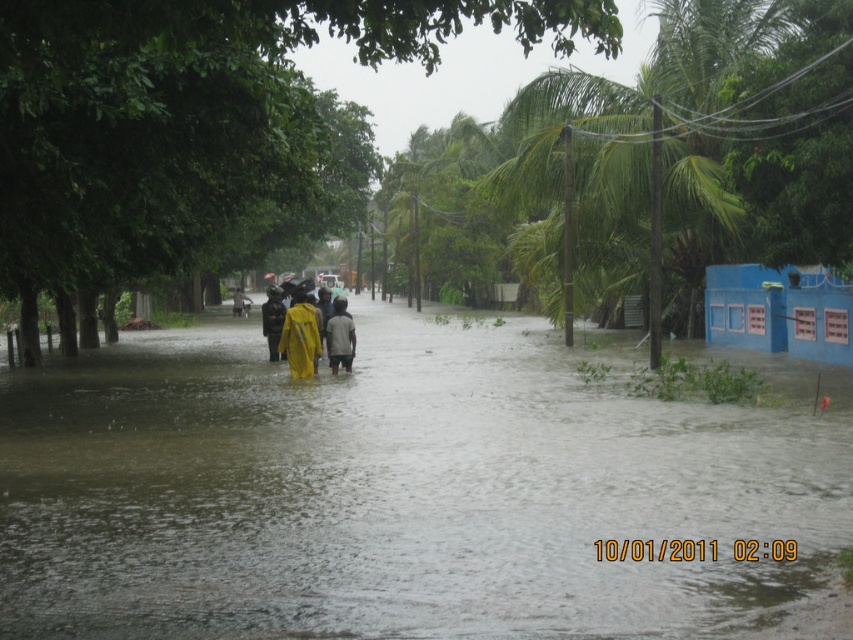
At what (x,y) coordinates should I click in order to perform the action: click on brown murky water at center. Please return your answer as a coordinate pair (x, y). Looking at the image, I should click on (392, 492).

Between point (572, 452) and point (267, 346), which one is positioned in front?

Point (572, 452) is in front.

This screenshot has width=853, height=640. What are the coordinates of `brown murky water at center` in the screenshot? It's located at (392, 492).

You are a GUI agent. You are given a task and a screenshot of the screen. Output one action in this format:
    pyautogui.click(x=<x>, y=<y>)
    Task: Click on the brown murky water at center
    The height and width of the screenshot is (640, 853).
    Given the screenshot: What is the action you would take?
    pyautogui.click(x=392, y=492)

Is yellow matte raincoat at center below light brown fabric jacket at center?

Correct, yellow matte raincoat at center is located below light brown fabric jacket at center.

Between yellow matte raincoat at center and light brown fabric jacket at center, which one is positioned lower?

yellow matte raincoat at center is below.

You are a GUI agent. You are given a task and a screenshot of the screen. Output one action in this format:
    pyautogui.click(x=<x>, y=<y>)
    Task: Click on the yellow matte raincoat at center
    
    Given the screenshot: What is the action you would take?
    point(300,333)

Identify the location of yellow matte raincoat at center. This screenshot has height=640, width=853. (300, 333).

Based on the photo, does yellow waterproof jacket at center have a greater width compared to light brown fabric jacket at center?

No.

Is yellow waterproof jacket at center to the right of light brown fabric jacket at center from the viewer's perspective?

No, yellow waterproof jacket at center is not to the right of light brown fabric jacket at center.

The width and height of the screenshot is (853, 640). What are the coordinates of `yellow waterproof jacket at center` in the screenshot? It's located at (300, 337).